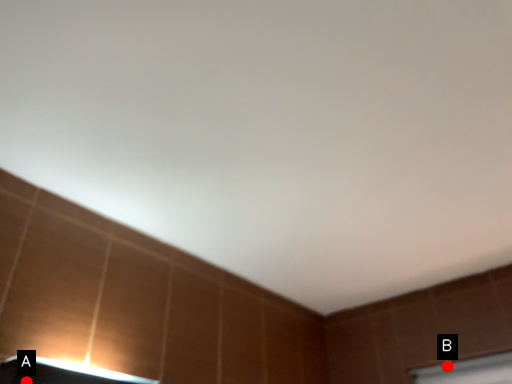
Question: Two points are circled on the image, labeled by A and B beside each circle. Among these points, which one is nearest to the camera?

Choices:
 (A) A is closer
 (B) B is closer

Answer: (A)